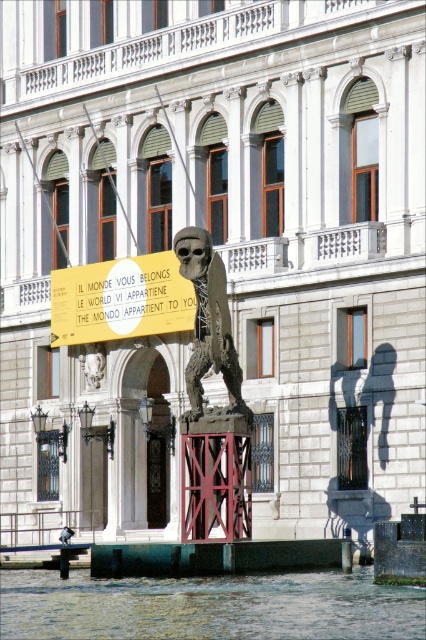
Question: Can you confirm if clear water at lower center is positioned below rustic bronze skeleton at center?

Choices:
 (A) yes
 (B) no

Answer: (A)

Question: Is clear water at lower center wider than yellow matte sign at center?

Choices:
 (A) no
 (B) yes

Answer: (B)

Question: Considering the real-world distances, which object is closest to the yellow matte sign at center?

Choices:
 (A) clear water at lower center
 (B) rustic bronze skeleton at center

Answer: (B)

Question: Does yellow matte sign at center have a smaller size compared to rustic bronze skeleton at center?

Choices:
 (A) no
 (B) yes

Answer: (B)

Question: Among these points, which one is farthest from the camera?

Choices:
 (A) (207, 252)
 (B) (69, 289)
 (C) (314, 621)

Answer: (B)

Question: Which of the following is the farthest from the observer?

Choices:
 (A) (80, 282)
 (B) (227, 310)
 (C) (158, 627)

Answer: (A)